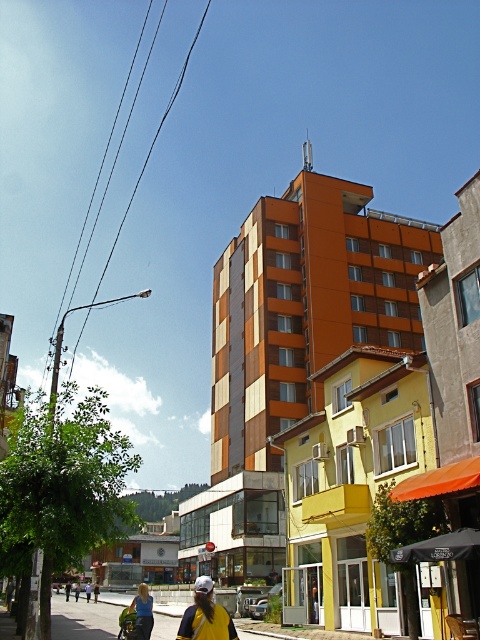
Question: Can you confirm if yellow fabric cap at center is positioned above blue fabric shirt at lower center?

Choices:
 (A) no
 (B) yes

Answer: (B)

Question: Can you confirm if yellow fabric cap at center is wider than blue fabric shirt at lower center?

Choices:
 (A) yes
 (B) no

Answer: (B)

Question: Which point appears farthest from the camera in this image?

Choices:
 (A) (93, 586)
 (B) (145, 624)
 (C) (178, 632)

Answer: (A)

Question: Which object is the closest to the yellow fabric umbrella at center?

Choices:
 (A) yellow fabric cap at center
 (B) blue fabric shirt at lower center

Answer: (B)

Question: Is blue fabric shirt at lower center wider than yellow fabric umbrella at center?

Choices:
 (A) no
 (B) yes

Answer: (B)

Question: Which point is farther to the camera?

Choices:
 (A) (144, 621)
 (B) (66, 600)

Answer: (B)